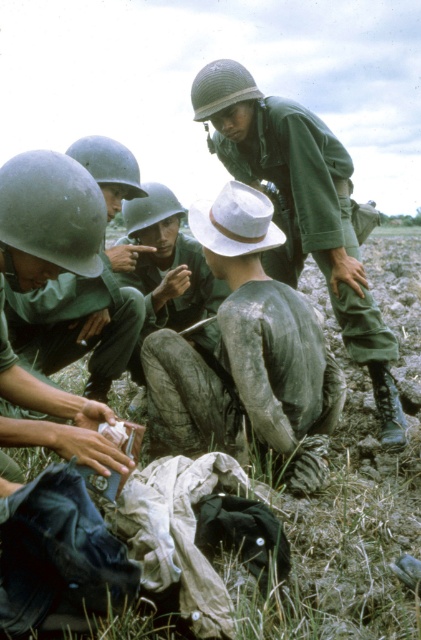
Can you confirm if worn canvas hat at center is thinner than matte green helmet at lower left?

In fact, worn canvas hat at center might be wider than matte green helmet at lower left.

In the scene shown: Is worn canvas hat at center bigger than matte green helmet at lower left?

No, worn canvas hat at center is not bigger than matte green helmet at lower left.

Does point (237, 221) lie behind point (95, 317)?

No.

Identify the location of worn canvas hat at center. The height and width of the screenshot is (640, 421). (247, 353).

Between green matte helmet at upper center and matte green helmet at lower left, which one appears on the right side from the viewer's perspective?

green matte helmet at upper center

Between green matte helmet at upper center and matte green helmet at lower left, which one has less height?

matte green helmet at lower left is shorter.

Which is behind, point (341, 244) or point (37, 364)?

The point (341, 244) is more distant.

Locate an element on the screen. This screenshot has height=640, width=421. green matte helmet at upper center is located at coordinates (303, 211).

What do you see at coordinates (247, 353) in the screenshot? This screenshot has width=421, height=640. I see `worn canvas hat at center` at bounding box center [247, 353].

Between worn canvas hat at center and green matte helmet at upper center, which one appears on the left side from the viewer's perspective?

From the viewer's perspective, worn canvas hat at center appears more on the left side.

Which is behind, point (172, 339) or point (269, 134)?

Point (269, 134)

Locate an element on the screen. worn canvas hat at center is located at coordinates (247, 353).